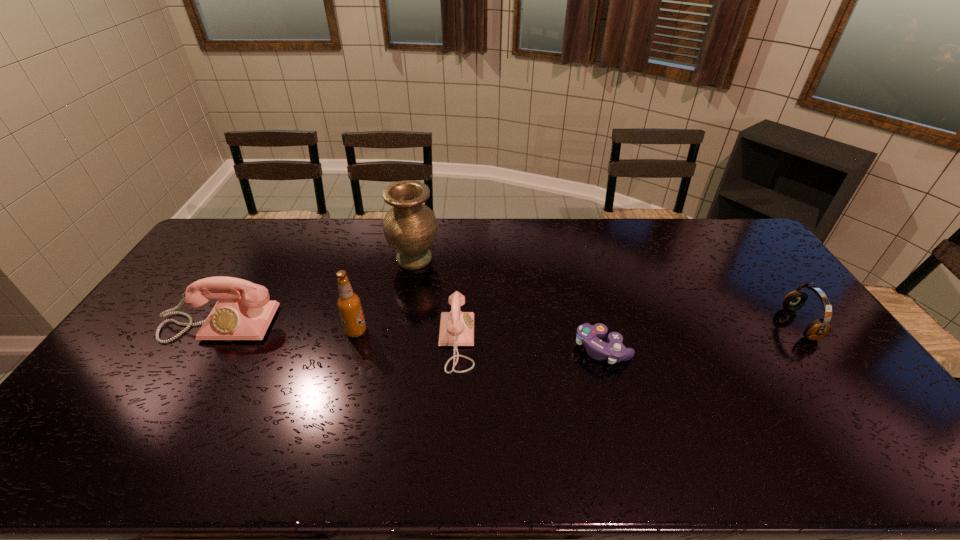
This screenshot has width=960, height=540. Find the location of `object that is at the left edge`. object that is at the left edge is located at coordinates (234, 317).

This screenshot has width=960, height=540. Find the location of `object positioned at the right edge`. object positioned at the right edge is located at coordinates (817, 329).

In the image, there is a desktop. Where is `free space at the far edge`? free space at the far edge is located at coordinates (570, 225).

Locate an element on the screen. The height and width of the screenshot is (540, 960). free space at the near edge is located at coordinates (521, 402).

Image resolution: width=960 pixels, height=540 pixels. Find the location of `vacant space at the left edge of the desktop`. vacant space at the left edge of the desktop is located at coordinates (129, 360).

Find the location of a particular element. vacant space at the right edge of the desktop is located at coordinates (861, 379).

In the image, there is a desktop. At what (x,y) coordinates should I click in order to perform the action: click on free space at the far left corner. Please return your answer as a coordinate pair (x, y). The image size is (960, 540). Looking at the image, I should click on (231, 237).

You are a GUI agent. You are given a task and a screenshot of the screen. Output one action in this format:
    pyautogui.click(x=<x>, y=<y>)
    Task: Click on the vacant space that is in between the rightmost object and the fifth object from left to right
    The image size is (960, 540).
    Given the screenshot: What is the action you would take?
    pyautogui.click(x=701, y=336)

The width and height of the screenshot is (960, 540). In order to click on free space between the headset and the left telephone in this screenshot , I will do `click(510, 324)`.

Find the location of a particular element. This screenshot has height=540, width=960. vacant space that's between the fourth object from right to left and the shortest object is located at coordinates (509, 303).